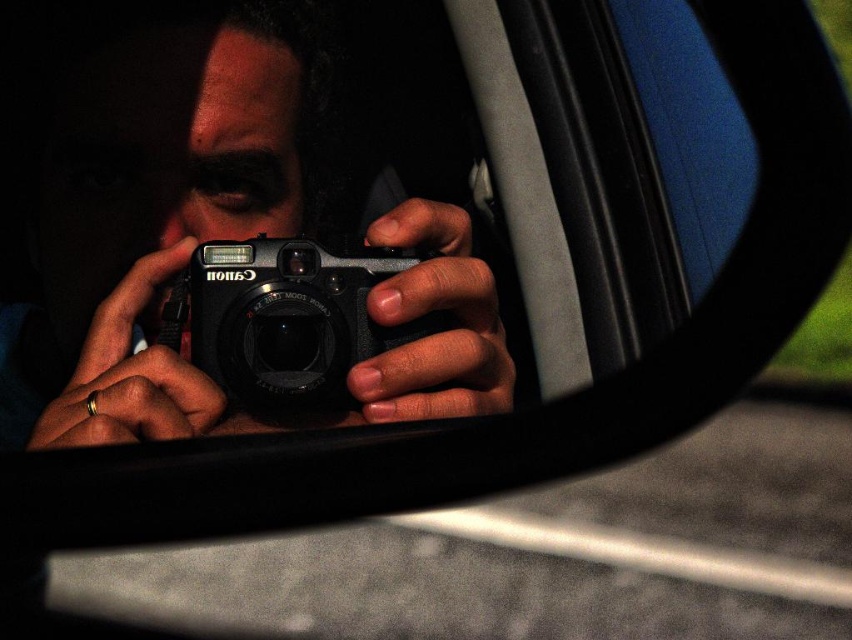
Can you confirm if matte black camera at center is wider than black plastic camera at center?

Indeed, matte black camera at center has a greater width compared to black plastic camera at center.

Between point (294, 20) and point (332, 348), which one is positioned behind?

The point (294, 20) is more distant.

Identify the location of matte black camera at center. The image size is (852, 640). (222, 230).

I want to click on matte black camera at center, so click(222, 230).